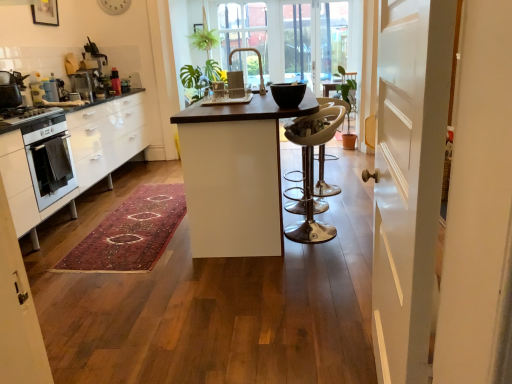
The image size is (512, 384). Identify the location of vacant space in front of metallic silver bar stool at center. (318, 251).